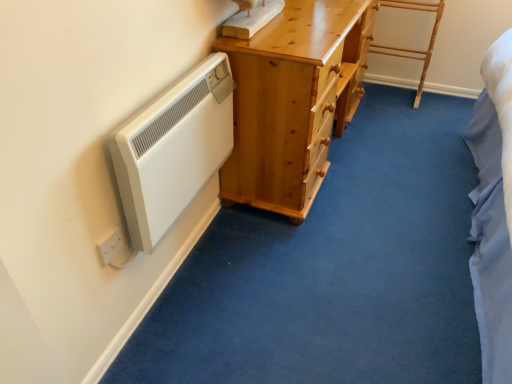
Identify the location of vacant space underneath light wood/rough textured ladder at upper right (from a real-world perspective). This screenshot has width=512, height=384. click(379, 89).